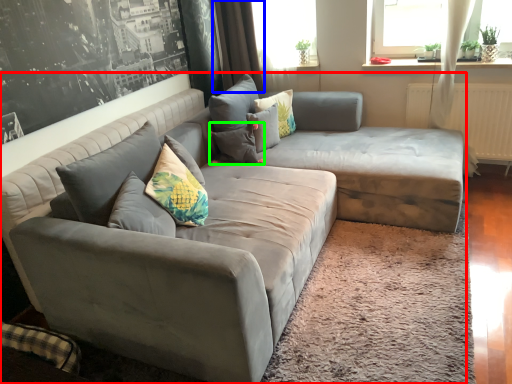
Question: Based on their relative distances, which object is farther from studio couch (highlighted by a red box)? Choose from curtain (highlighted by a blue box) and pillow (highlighted by a green box).

Choices:
 (A) curtain
 (B) pillow

Answer: (A)